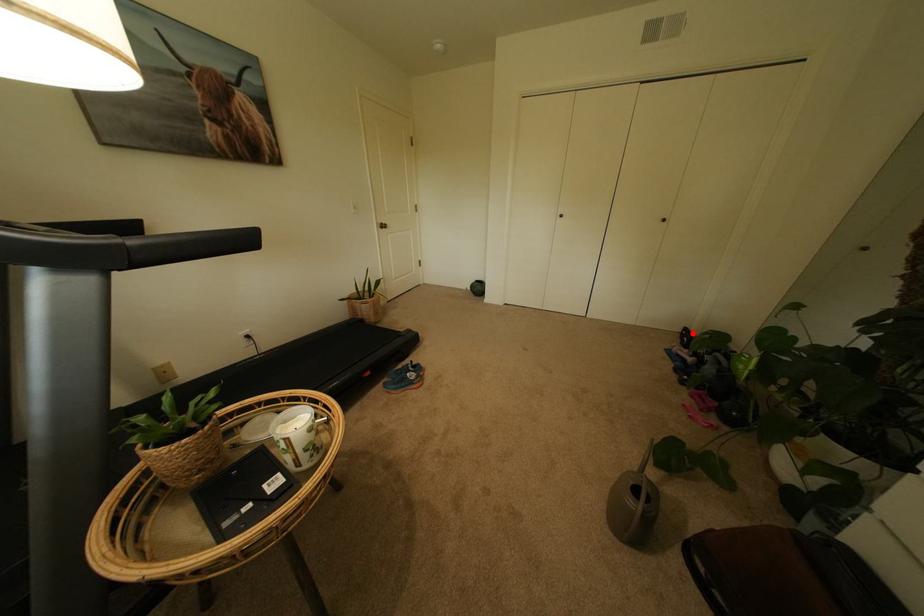
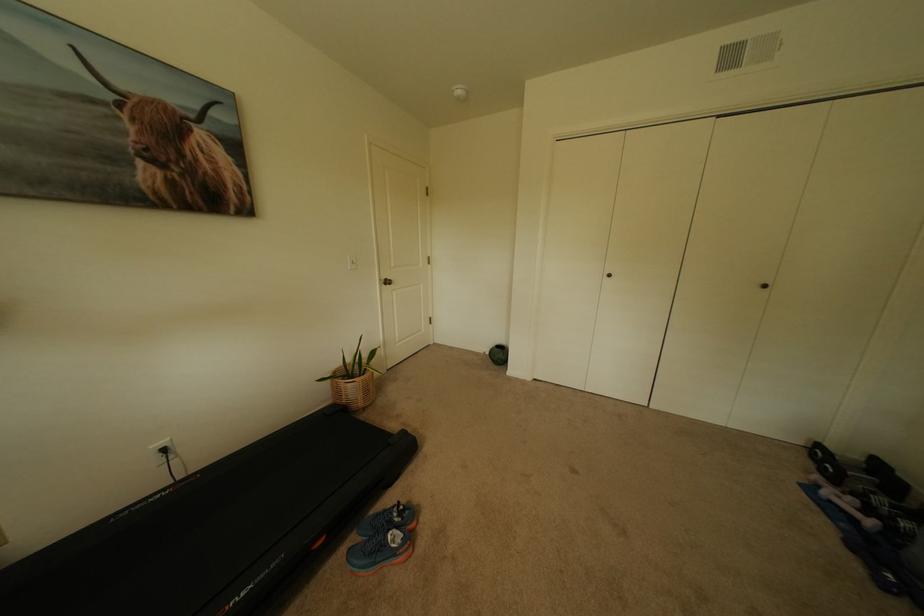
The point at the highlighted location is marked in the first image. Where is the corresponding point in the second image?

(827, 452)